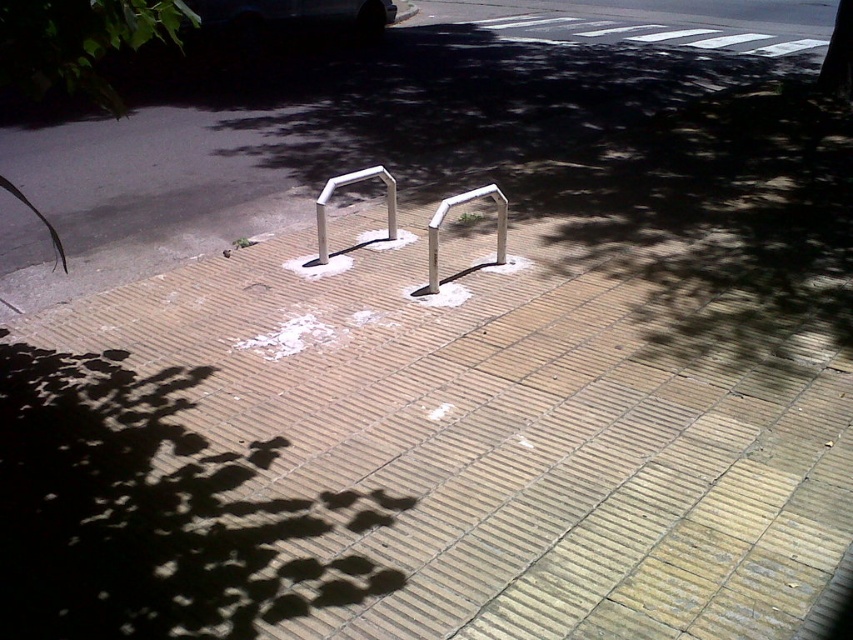
You are standing at the origin point of the image coordinate system. You want to walk to the white metallic rail at center. What are the coordinates you need to move to?

You need to move to the coordinates point at (445, 212) to reach the white metallic rail at center.

You are a delivery person who needs to place a package on the ground. The package is 2 inches tall. Can you place it on the brown brick pavement at center without it being taller than the silver metallic rail at center?

The brown brick pavement at center is taller than the silver metallic rail at center. Since the package is 2 inches tall, placing it on the brown brick pavement at center would make it taller than the rail. Therefore, you cannot place the package there without it exceeding the rail height.